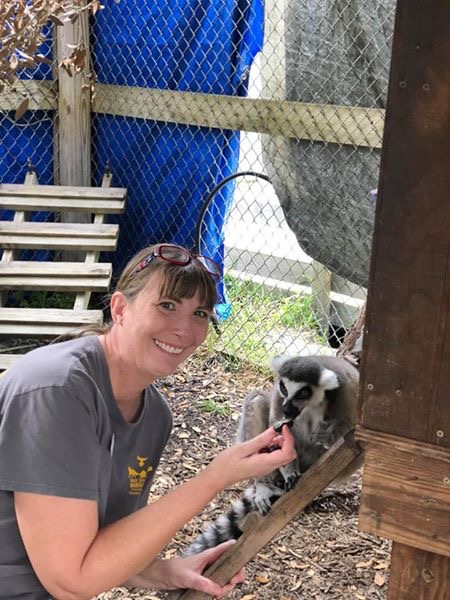
Find the location of a particular element. board is located at coordinates (129, 106).